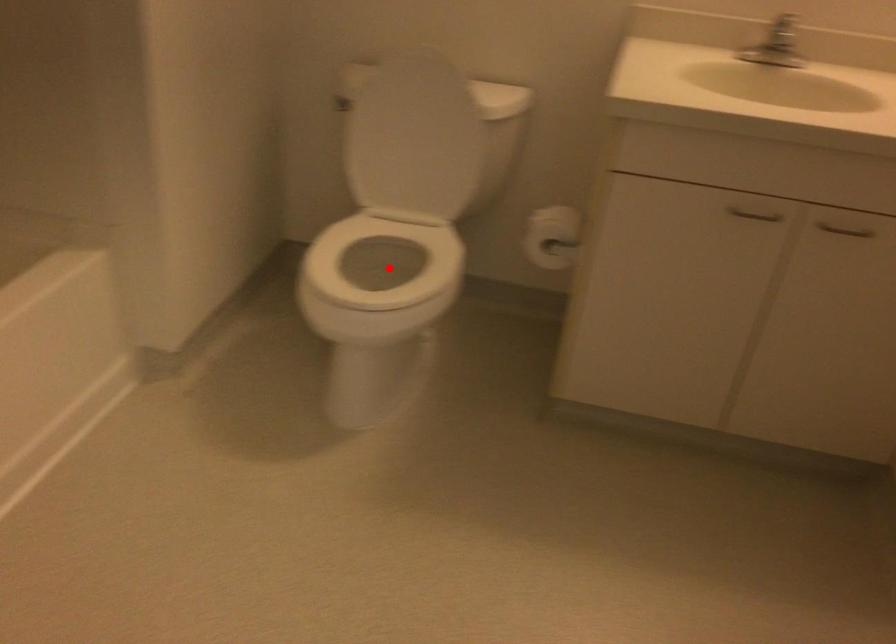
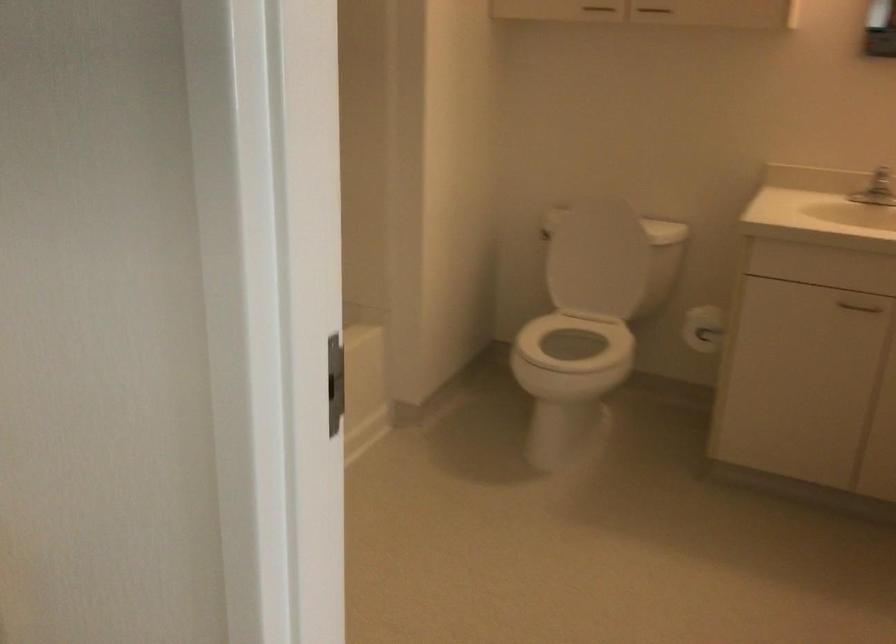
Question: I am providing you with two images of the same scene from different viewpoints. In image1, a red point is highlighted. Considering the same 3D point in image2, which of the following is correct?

Choices:
 (A) It is closer
 (B) It is farther

Answer: (B)